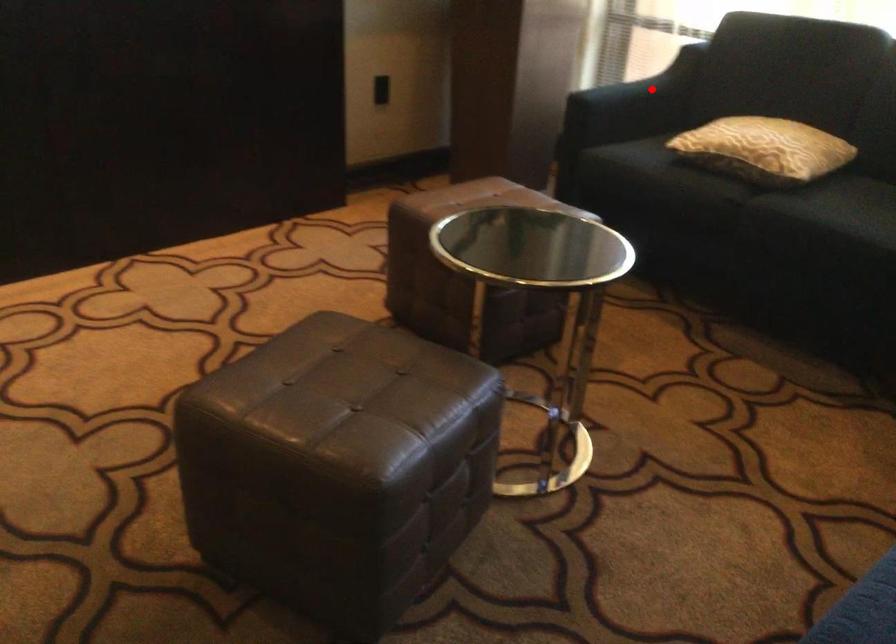
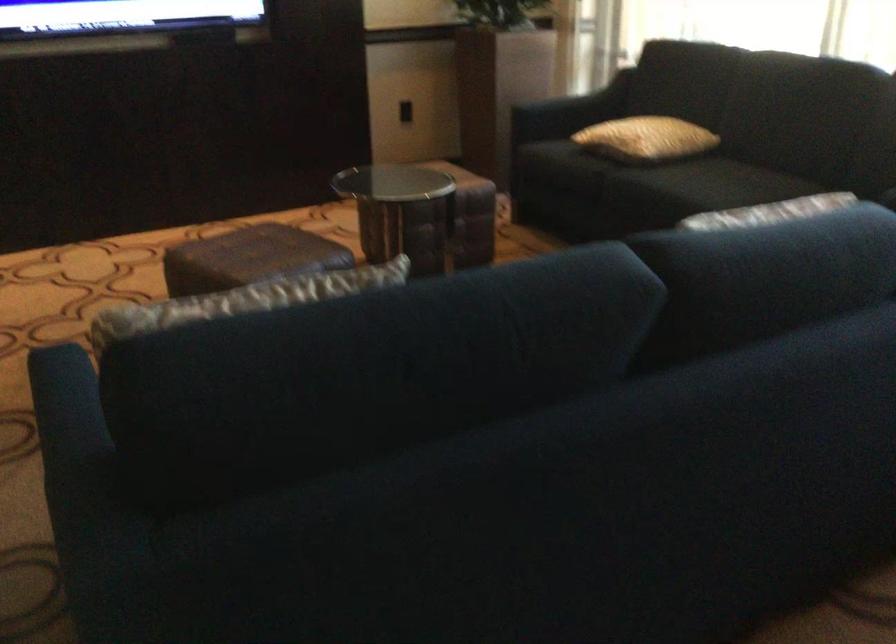
Where in the second image is the point corresponding to the highlighted location from the first image?

(586, 99)